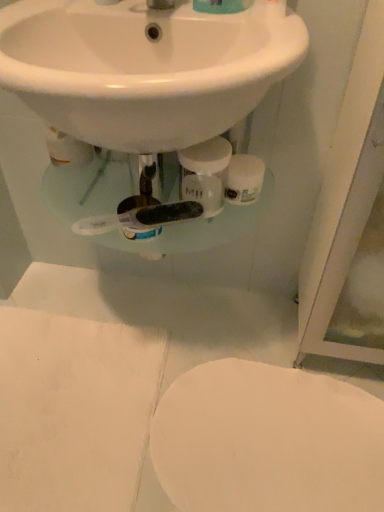
The image size is (384, 512). In order to click on vacant area on top of white glossy toilet at lower right (from a real-world perspective) in this screenshot , I will do coord(273,434).